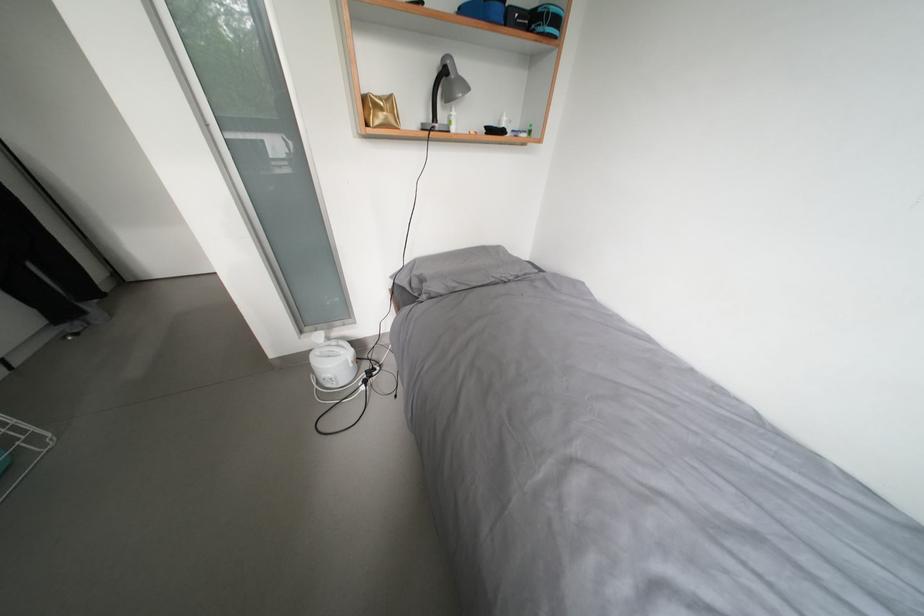
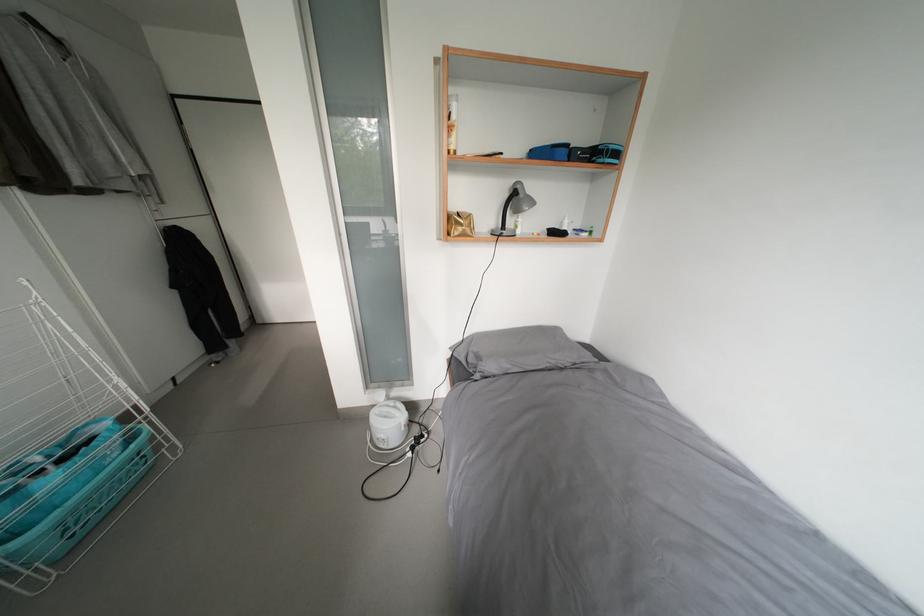
Question: How did the camera likely rotate?

Choices:
 (A) Left
 (B) Right
 (C) Up
 (D) Down

Answer: (A)